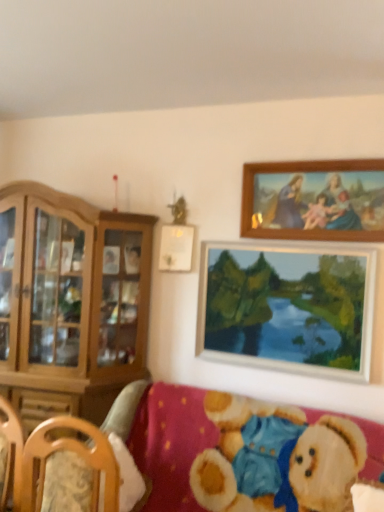
Question: Is wooden frame painting at upper right, arranged as the third picture frame when viewed from the top, facing away from wooden picture frame at upper right, which is counted as the 3th picture frame, starting from the bottom?

Choices:
 (A) yes
 (B) no

Answer: (B)

Question: Is the surface of wooden frame painting at upper right, the 1th picture frame ordered from the bottom, in direct contact with wooden picture frame at upper right, the 1th picture frame in the top-to-bottom sequence?

Choices:
 (A) no
 (B) yes

Answer: (A)

Question: From a real-world perspective, is wooden frame painting at upper right, the 1th picture frame ordered from the bottom, on top of wooden picture frame at upper right, the 1th picture frame in the top-to-bottom sequence?

Choices:
 (A) yes
 (B) no

Answer: (B)

Question: Does wooden frame painting at upper right, the 1th picture frame ordered from the bottom, lie behind wooden picture frame at upper right, the 1th picture frame in the top-to-bottom sequence?

Choices:
 (A) yes
 (B) no

Answer: (A)

Question: From the image's perspective, would you say wooden frame painting at upper right, arranged as the third picture frame when viewed from the top, is shown under wooden picture frame at upper right, which is counted as the 3th picture frame, starting from the bottom?

Choices:
 (A) yes
 (B) no

Answer: (A)

Question: From the image's perspective, is wooden frame painting at upper right, the 1th picture frame ordered from the bottom, over wooden picture frame at upper right, which is counted as the 3th picture frame, starting from the bottom?

Choices:
 (A) no
 (B) yes

Answer: (A)

Question: Considering the relative sizes of wooden picture frame at upper right, the 1th picture frame in the top-to-bottom sequence, and wooden frame painting at upper right, arranged as the third picture frame when viewed from the top, in the image provided, is wooden picture frame at upper right, the 1th picture frame in the top-to-bottom sequence, wider than wooden frame painting at upper right, arranged as the third picture frame when viewed from the top,?

Choices:
 (A) no
 (B) yes

Answer: (B)

Question: Considering the relative sizes of wooden picture frame at upper right, the 1th picture frame in the top-to-bottom sequence, and wooden frame painting at upper right, the 1th picture frame ordered from the bottom, in the image provided, is wooden picture frame at upper right, the 1th picture frame in the top-to-bottom sequence, thinner than wooden frame painting at upper right, the 1th picture frame ordered from the bottom,?

Choices:
 (A) yes
 (B) no

Answer: (B)

Question: Is wooden picture frame at upper right, the 1th picture frame in the top-to-bottom sequence, smaller than wooden frame painting at upper right, arranged as the third picture frame when viewed from the top?

Choices:
 (A) yes
 (B) no

Answer: (A)

Question: Considering the relative positions of wooden picture frame at upper right, the 1th picture frame in the top-to-bottom sequence, and wooden frame painting at upper right, arranged as the third picture frame when viewed from the top, in the image provided, is wooden picture frame at upper right, the 1th picture frame in the top-to-bottom sequence, to the right of wooden frame painting at upper right, arranged as the third picture frame when viewed from the top, from the viewer's perspective?

Choices:
 (A) no
 (B) yes

Answer: (B)

Question: From the image's perspective, is wooden picture frame at upper right, which is counted as the 3th picture frame, starting from the bottom, located above wooden frame painting at upper right, arranged as the third picture frame when viewed from the top?

Choices:
 (A) no
 (B) yes

Answer: (B)

Question: Is wooden picture frame at upper right, which is counted as the 3th picture frame, starting from the bottom, facing away from wooden frame painting at upper right, arranged as the third picture frame when viewed from the top?

Choices:
 (A) yes
 (B) no

Answer: (B)

Question: Does wooden picture frame at upper center, the 2th picture frame in the bottom-to-top sequence, have a larger size compared to velvet teddy bear at lower right?

Choices:
 (A) no
 (B) yes

Answer: (A)